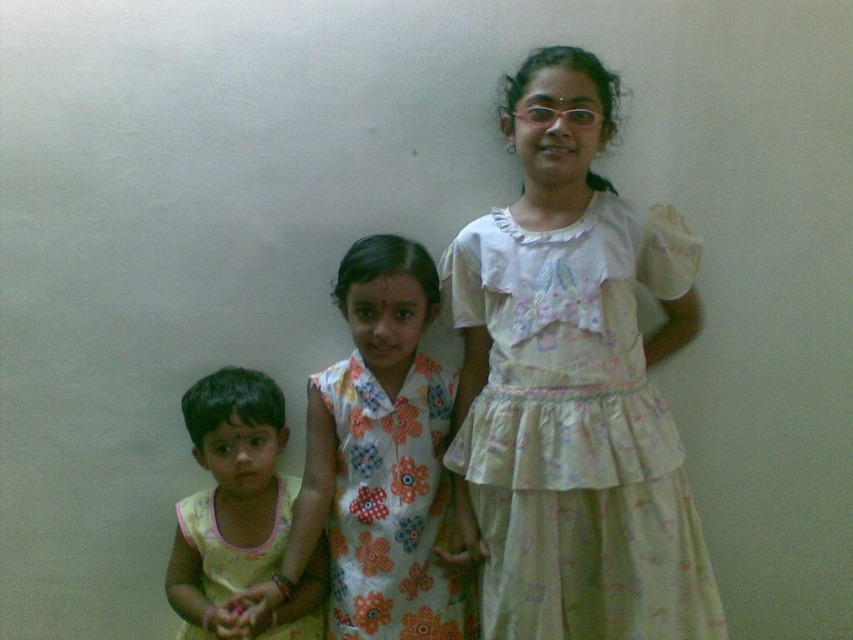
Question: Estimate the real-world distances between objects in this image. Which object is closer to the white satin dress at upper right?

Choices:
 (A) yellow cotton dress at lower left
 (B) floral-patterned fabric dress at center

Answer: (B)

Question: Does white satin dress at upper right appear on the left side of floral dress at center?

Choices:
 (A) yes
 (B) no

Answer: (B)

Question: Which object is closer to the camera taking this photo?

Choices:
 (A) floral dress at center
 (B) white satin dress at upper right
 (C) floral-patterned fabric dress at center

Answer: (B)

Question: Which object is the farthest from the floral dress at center?

Choices:
 (A) floral-patterned fabric dress at center
 (B) white satin dress at upper right
 (C) yellow cotton dress at lower left

Answer: (B)

Question: Does floral dress at center appear under yellow cotton dress at lower left?

Choices:
 (A) yes
 (B) no

Answer: (B)

Question: Is floral dress at center to the right of yellow cotton dress at lower left from the viewer's perspective?

Choices:
 (A) yes
 (B) no

Answer: (A)